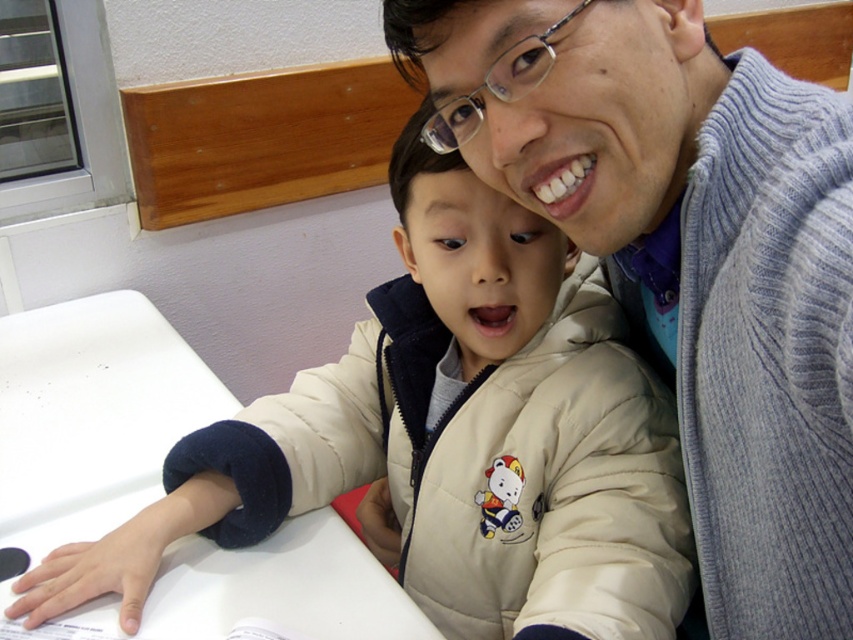
Question: Is gray knit sweater at upper right below white matte table at lower left?

Choices:
 (A) yes
 (B) no

Answer: (B)

Question: Which is nearer to the white matte table at lower left?

Choices:
 (A) beige quilted jacket at center
 (B) gray knit sweater at upper right

Answer: (A)

Question: Can you confirm if gray knit sweater at upper right is bigger than beige quilted jacket at center?

Choices:
 (A) yes
 (B) no

Answer: (B)

Question: Which object is farther from the camera taking this photo?

Choices:
 (A) beige quilted jacket at center
 (B) gray knit sweater at upper right

Answer: (A)

Question: Which object is positioned closest to the gray knit sweater at upper right?

Choices:
 (A) white matte table at lower left
 (B) beige quilted jacket at center

Answer: (B)

Question: Does gray knit sweater at upper right appear over beige quilted jacket at center?

Choices:
 (A) no
 (B) yes

Answer: (B)